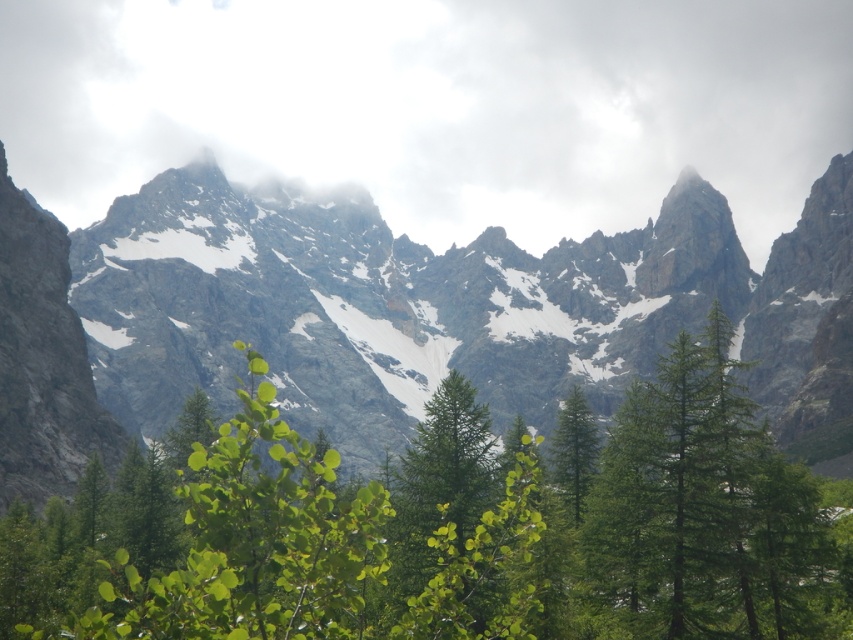
Question: Does green leafy tree at center have a smaller size compared to white fluffy cloud at upper center?

Choices:
 (A) no
 (B) yes

Answer: (B)

Question: Which point is farther to the camera?

Choices:
 (A) green matte tree at center
 (B) rocky gray mountain range at center
 (C) white fluffy cloud at upper center

Answer: (C)

Question: Is white fluffy cloud at upper center closer to camera compared to rocky gray mountain range at center?

Choices:
 (A) no
 (B) yes

Answer: (A)

Question: Is green leafy tree at center below green matte tree at center?

Choices:
 (A) no
 (B) yes

Answer: (B)

Question: Estimate the real-world distances between objects in this image. Which object is closer to the rocky gray mountain range at center?

Choices:
 (A) green matte tree at center
 (B) white fluffy cloud at upper center

Answer: (B)

Question: Which of the following is the closest to the observer?

Choices:
 (A) 799,266
 (B) 515,192

Answer: (A)